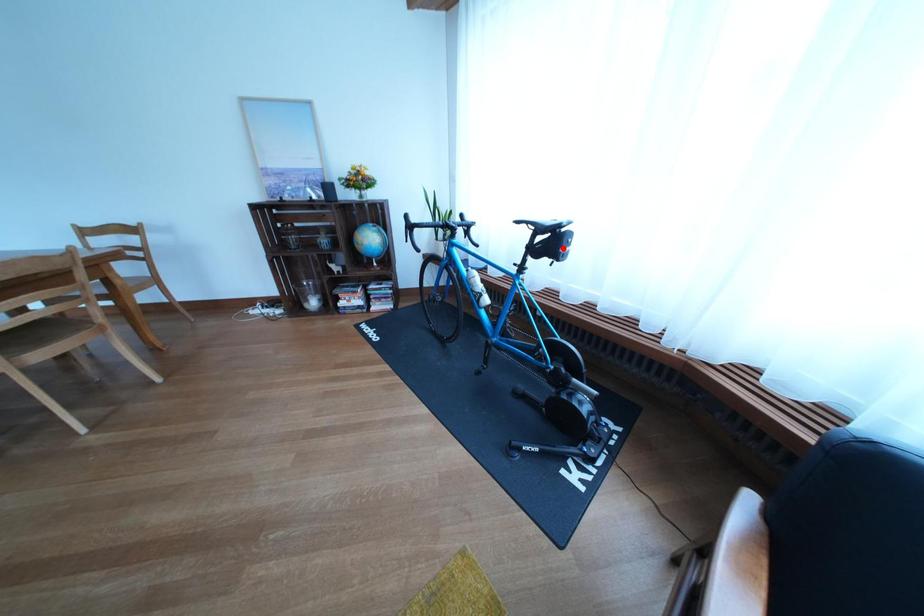
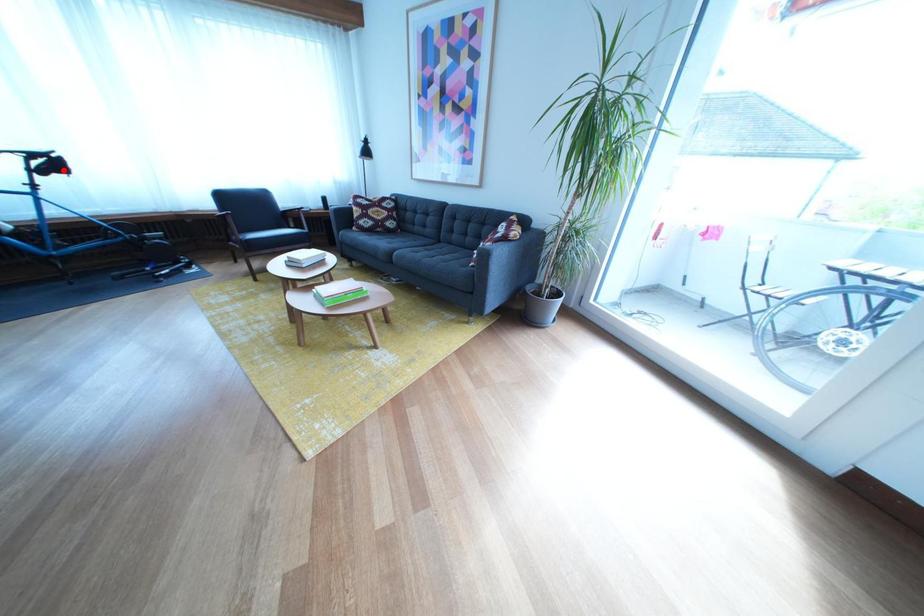
I am providing you with two images of the same scene from different viewpoints. A red point is marked on the first image and another point is marked on the second image. Do the highlighted points in image1 and image2 indicate the same real-world spot?

Yes